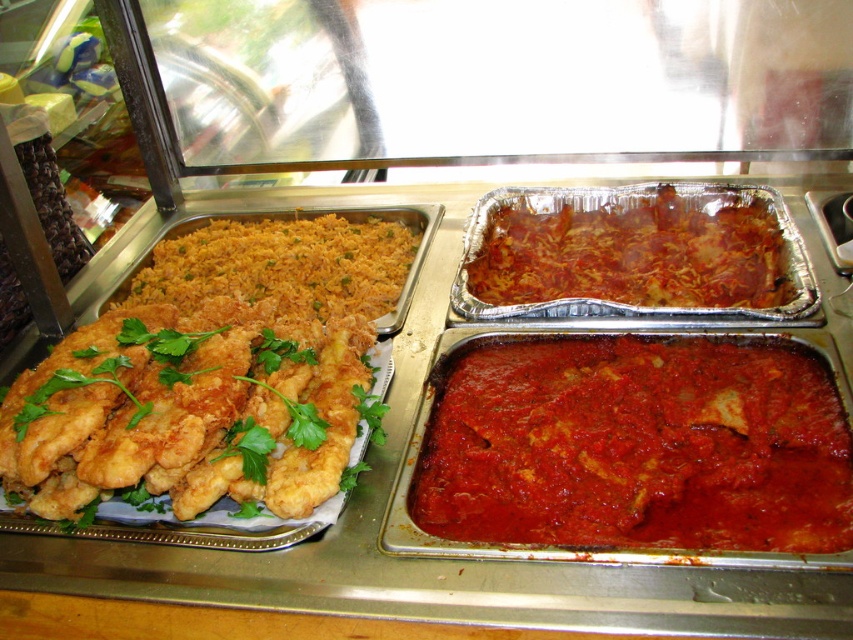
Does red matte lasagna at center have a smaller size compared to yellow rice at left?

Indeed, red matte lasagna at center has a smaller size compared to yellow rice at left.

Is point (613, 204) positioned after point (360, 220)?

That is False.

Locate an element on the screen. This screenshot has width=853, height=640. red matte lasagna at center is located at coordinates (631, 252).

Which is in front, point (624, 497) or point (126, 388)?

Point (624, 497) is more forward.

Based on the photo, can you confirm if red matte sauce at center is positioned below golden fried chicken strips at left?

Correct, red matte sauce at center is located below golden fried chicken strips at left.

The width and height of the screenshot is (853, 640). What do you see at coordinates (636, 445) in the screenshot?
I see `red matte sauce at center` at bounding box center [636, 445].

I want to click on red matte sauce at center, so click(636, 445).

Is red matte sauce at center shorter than yellow rice at left?

Yes, red matte sauce at center is shorter than yellow rice at left.

Can you confirm if red matte sauce at center is taller than yellow rice at left?

No, red matte sauce at center is not taller than yellow rice at left.

Identify the location of red matte sauce at center. The width and height of the screenshot is (853, 640). (636, 445).